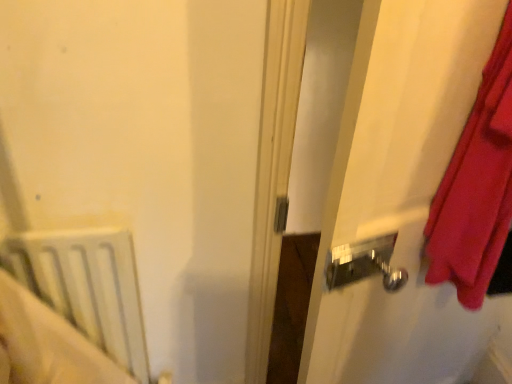
Question: Does white glossy door handle at right come behind white matte radiator at lower left?

Choices:
 (A) yes
 (B) no

Answer: (B)

Question: From the image's perspective, would you say white glossy door handle at right is shown under white matte radiator at lower left?

Choices:
 (A) yes
 (B) no

Answer: (B)

Question: Is white glossy door handle at right not inside white matte radiator at lower left?

Choices:
 (A) yes
 (B) no

Answer: (A)

Question: From a real-world perspective, is white glossy door handle at right located higher than white matte radiator at lower left?

Choices:
 (A) no
 (B) yes

Answer: (B)

Question: Could you tell me if white glossy door handle at right is turned towards white matte radiator at lower left?

Choices:
 (A) no
 (B) yes

Answer: (A)

Question: Does white glossy door handle at right have a greater height compared to white matte radiator at lower left?

Choices:
 (A) no
 (B) yes

Answer: (B)

Question: From the image's perspective, is white matte radiator at lower left beneath white glossy door handle at right?

Choices:
 (A) no
 (B) yes

Answer: (B)

Question: Considering the relative sizes of white matte radiator at lower left and white glossy door handle at right in the image provided, is white matte radiator at lower left taller than white glossy door handle at right?

Choices:
 (A) yes
 (B) no

Answer: (B)

Question: Does white matte radiator at lower left have a lesser width compared to white glossy door handle at right?

Choices:
 (A) no
 (B) yes

Answer: (B)

Question: Does white matte radiator at lower left have a lesser height compared to white glossy door handle at right?

Choices:
 (A) no
 (B) yes

Answer: (B)

Question: Is white matte radiator at lower left oriented towards white glossy door handle at right?

Choices:
 (A) no
 (B) yes

Answer: (A)

Question: Is white matte radiator at lower left facing away from white glossy door handle at right?

Choices:
 (A) no
 (B) yes

Answer: (A)

Question: From a real-world perspective, is white glossy door handle at right above or below white matte radiator at lower left?

Choices:
 (A) above
 (B) below

Answer: (A)